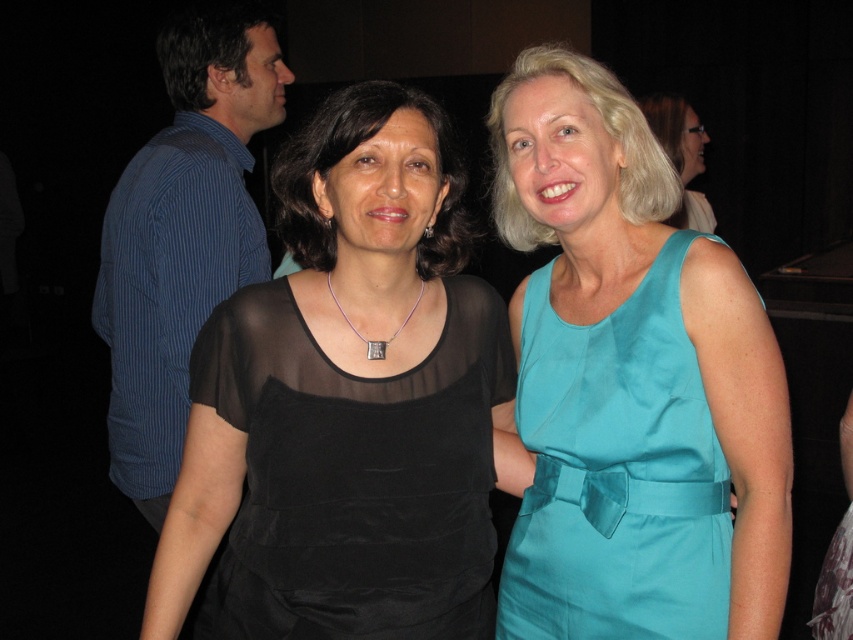
You are standing in front of the two women in the image. You want to place a small decoration between the two points labeled as point (299, 500) and point (679, 113). Which point should the decoration be closer to in order to be nearer to you?

The decoration should be closer to point (299, 500) because it is closer to the viewer than point (679, 113).

Consider the image. You are organizing a photoshoot and need to arrange the models according to their dress colors. The sheer black dress at center and the teal satin dress at right are part of the setup. Based on their positions, which dress should be moved to the left to align with the color scheme requirement where black comes before teal?

The teal satin dress at right should be moved to the left of the sheer black dress at center because the sheer black dress at center is already positioned on the left side of the teal satin dress at right, so to follow the color order, the teal dress needs to be shifted left to maintain black before teal.

You are organizing a photo shoot and need to ensure that the sheer black dress at center and the silver metallic square at center fit within a rectangular frame. Based on their sizes, can both items be placed side by side without overlapping?

The sheer black dress at center might be wider than silver metallic square at center, so there is a possibility that they cannot be placed side by side without overlapping if the frame is not sufficiently wide. Ensure the frame accommodates the wider of the two items.